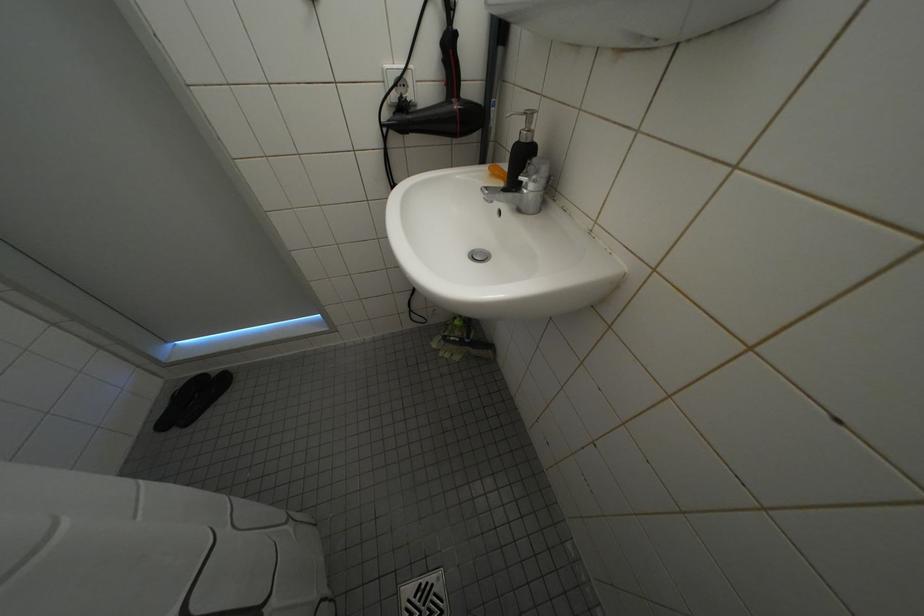
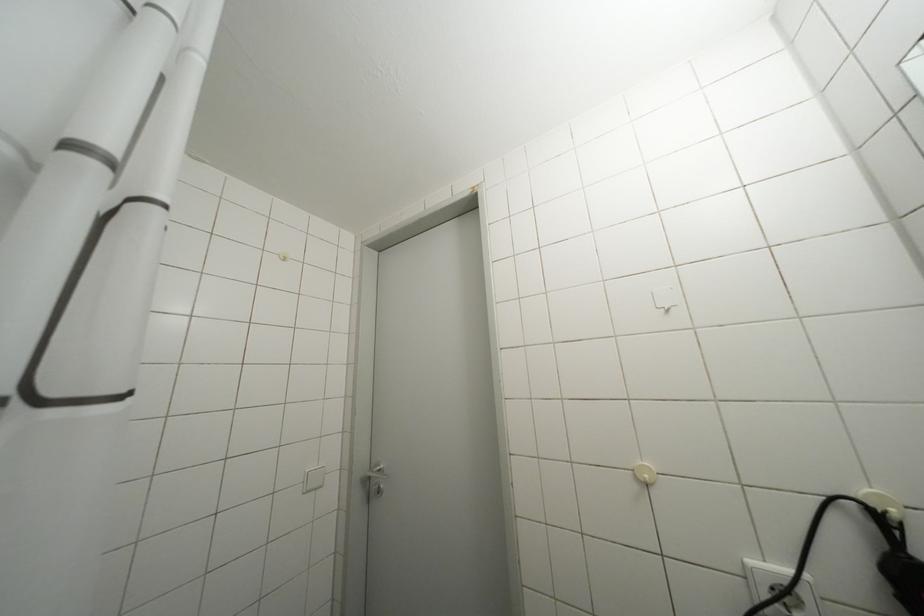
How did the camera likely rotate?

The rotation direction of the camera is left-up.